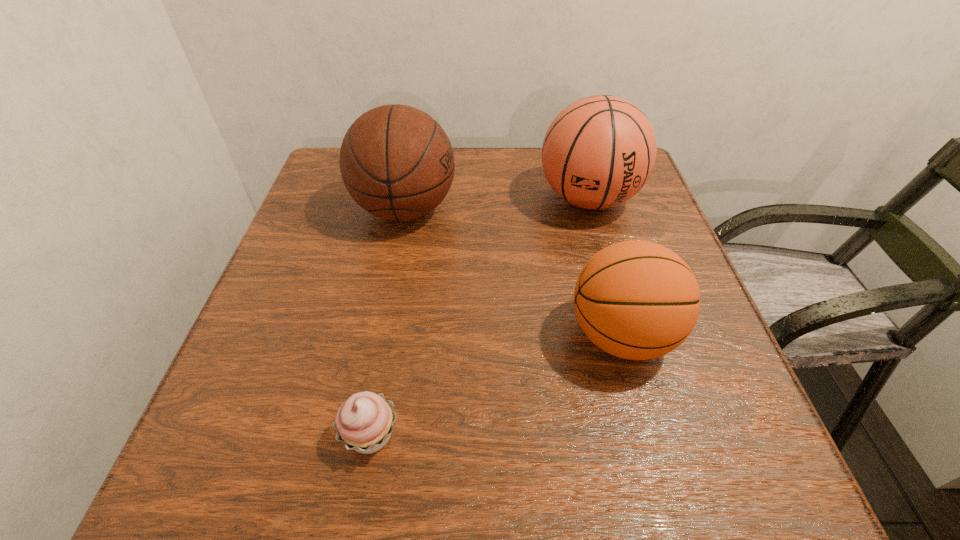
The height and width of the screenshot is (540, 960). Identify the location of free point between the shortest object and the second shortest object. (495, 385).

Identify the location of object that can be found as the closest to the leftmost basketball. (599, 151).

Choose which object is the third nearest neighbor to the third tallest object. Please provide its 2D coordinates. Your answer should be formatted as a tuple, i.e. [(x, y)], where the tuple contains the x and y coordinates of a point satisfying the conditions above.

[(364, 422)]

You are a GUI agent. You are given a task and a screenshot of the screen. Output one action in this format:
    pyautogui.click(x=<x>, y=<y>)
    Task: Click on the closest basketball to the shortest basketball
    
    Given the screenshot: What is the action you would take?
    pyautogui.click(x=599, y=151)

Locate which basketball ranks second in proximity to the nearest basketball. Please provide its 2D coordinates. Your answer should be formatted as a tuple, i.e. [(x, y)], where the tuple contains the x and y coordinates of a point satisfying the conditions above.

[(397, 163)]

Identify the location of blank space that satisfies the following two spatial constraints: 1. on the side with brand label of the leftmost basketball; 2. on the right side of the shortest basketball. (381, 335).

You are a GUI agent. You are given a task and a screenshot of the screen. Output one action in this format:
    pyautogui.click(x=<x>, y=<y>)
    Task: Click on the free space that satisfies the following two spatial constraints: 1. on the back side of the third farthest object; 2. on the right side of the cupcake
    This screenshot has height=540, width=960.
    Given the screenshot: What is the action you would take?
    point(388,335)

Find the location of a particular element. The height and width of the screenshot is (540, 960). vacant space that satisfies the following two spatial constraints: 1. on the side with brand label of the third farthest object; 2. on the right side of the leftmost basketball is located at coordinates coord(381,335).

Image resolution: width=960 pixels, height=540 pixels. What are the coordinates of `vacant position in the image that satisfies the following two spatial constraints: 1. on the side with brand label of the nearest object; 2. on the right side of the leftmost basketball` in the screenshot? It's located at (362, 435).

The height and width of the screenshot is (540, 960). I want to click on free space that satisfies the following two spatial constraints: 1. on the side with brand label of the leftmost basketball; 2. on the right side of the nearest basketball, so click(x=381, y=335).